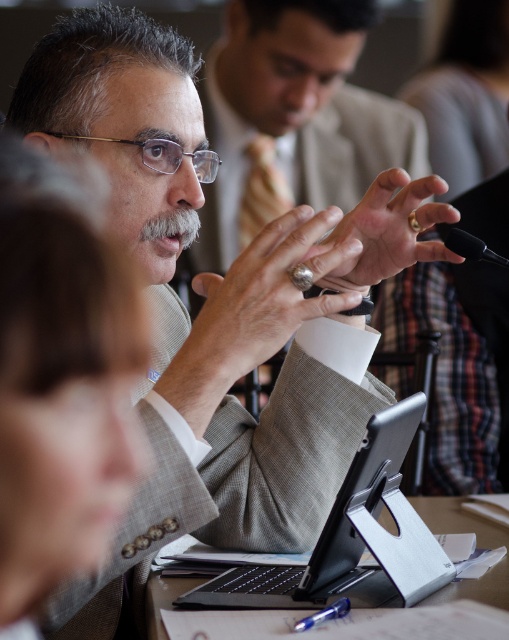
You are an attendee at this meeting and need to place both the black matte laptop at center and the black plastic tablet at center on a table that can only accommodate one of them. Which device should you choose to ensure it fits?

The black matte laptop at center is wider than the black plastic tablet at center, so you should choose the black plastic tablet at center to ensure it fits on the table.

You are organizing a presentation and need to place both the black plastic tablet at center and the black matte microphone at center on a small table. Considering their sizes, which one should you place first to ensure they both fit?

The black plastic tablet at center is larger than the black matte microphone at center, so you should place the black plastic tablet at center first to ensure both items fit on the small table.